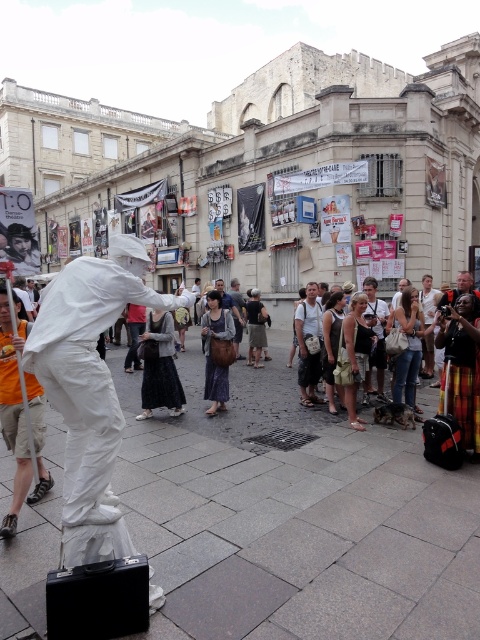
Locate an element on the screen. This screenshot has height=640, width=480. white cotton shirt at center is located at coordinates (375, 336).

Who is positioned more to the right, dark grey fabric dress at center or brown woven dress at center?

brown woven dress at center is more to the right.

From the picture: Is dark grey fabric dress at center bigger than brown woven dress at center?

Indeed, dark grey fabric dress at center has a larger size compared to brown woven dress at center.

The height and width of the screenshot is (640, 480). I want to click on dark grey fabric dress at center, so click(159, 365).

Is point (23, 365) in front of point (172, 392)?

Yes.

Looking at this image, how distant is white matte suit at center from dark grey fabric dress at center?

The distance of white matte suit at center from dark grey fabric dress at center is 1.47 meters.

Who is more forward, (113, 288) or (146, 396)?

Point (113, 288)

At what (x,y) coordinates should I click in order to perform the action: click on white matte suit at center. Please return your answer as a coordinate pair (x, y). The image size is (480, 640). Looking at the image, I should click on [x=90, y=387].